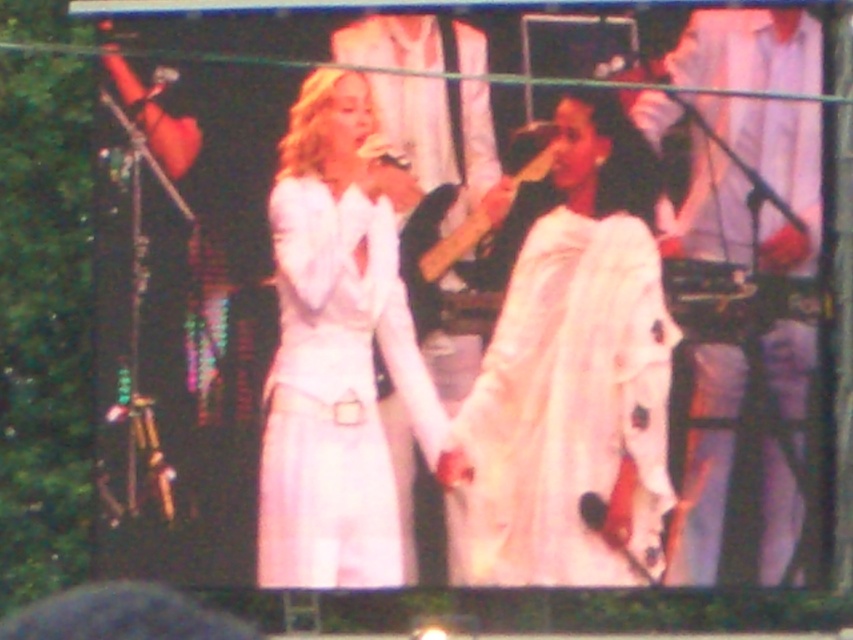
Which is more to the right, white satin dress at center or wooden guitar at center?

wooden guitar at center

Between point (408, 410) and point (548, 161), which one is positioned in front?

Point (408, 410) is more forward.

Identify the location of white satin dress at center. This screenshot has width=853, height=640. (337, 348).

Which is more to the left, white cotton shirt at right or wooden guitar at center?

wooden guitar at center is more to the left.

Which of these two, white cotton shirt at right or wooden guitar at center, stands taller?

Standing taller between the two is white cotton shirt at right.

Identify the location of white cotton shirt at right. Image resolution: width=853 pixels, height=640 pixels. (776, 170).

Is white textured dress at center above white cotton shirt at right?

No, white textured dress at center is not above white cotton shirt at right.

Is white textured dress at center thinner than white cotton shirt at right?

No, white textured dress at center is not thinner than white cotton shirt at right.

Which is in front, point (512, 388) or point (699, 444)?

Positioned in front is point (699, 444).

You are a GUI agent. You are given a task and a screenshot of the screen. Output one action in this format:
    pyautogui.click(x=<x>, y=<y>)
    Task: Click on the white textured dress at center
    
    Given the screenshot: What is the action you would take?
    pyautogui.click(x=566, y=410)